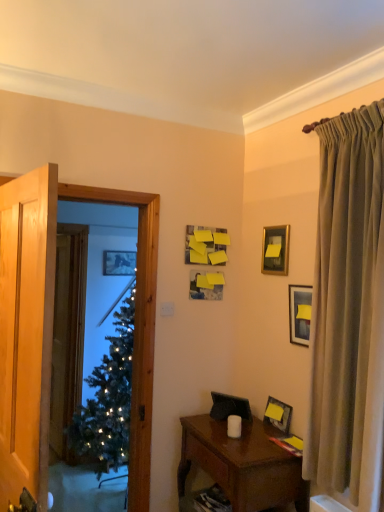
Identify the location of empty space that is ontop of brown wooden nightstand at lower right (from a real-world perspective). This screenshot has width=384, height=512. (248, 433).